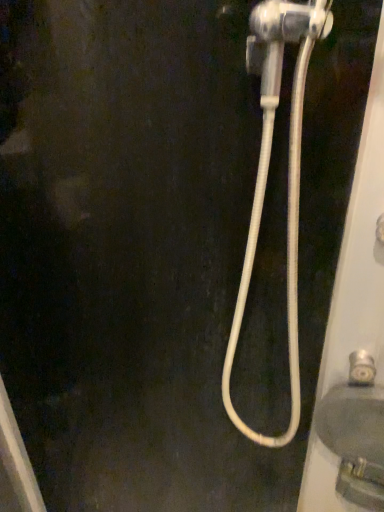
Question: Is silver metallic faucet at lower right far away from matte gray sink at lower right?

Choices:
 (A) yes
 (B) no

Answer: (B)

Question: Is silver metallic faucet at lower right not within matte gray sink at lower right?

Choices:
 (A) yes
 (B) no

Answer: (A)

Question: Does silver metallic faucet at lower right have a lesser width compared to matte gray sink at lower right?

Choices:
 (A) no
 (B) yes

Answer: (B)

Question: Would you say matte gray sink at lower right is part of silver metallic faucet at lower right's contents?

Choices:
 (A) no
 (B) yes

Answer: (A)

Question: Considering the relative positions of silver metallic faucet at lower right and matte gray sink at lower right in the image provided, is silver metallic faucet at lower right to the left of matte gray sink at lower right from the viewer's perspective?

Choices:
 (A) no
 (B) yes

Answer: (B)

Question: From the image's perspective, would you say silver metallic faucet at lower right is shown under matte gray sink at lower right?

Choices:
 (A) yes
 (B) no

Answer: (B)

Question: Can we say matte gray sink at lower right lies outside white rubber hose at right?

Choices:
 (A) no
 (B) yes

Answer: (B)

Question: Is matte gray sink at lower right touching white rubber hose at right?

Choices:
 (A) no
 (B) yes

Answer: (A)

Question: Considering the relative positions of matte gray sink at lower right and white rubber hose at right in the image provided, is matte gray sink at lower right behind white rubber hose at right?

Choices:
 (A) yes
 (B) no

Answer: (A)

Question: Is white rubber hose at right located within matte gray sink at lower right?

Choices:
 (A) no
 (B) yes

Answer: (A)

Question: Are matte gray sink at lower right and white rubber hose at right far apart?

Choices:
 (A) no
 (B) yes

Answer: (A)

Question: Is matte gray sink at lower right shorter than white rubber hose at right?

Choices:
 (A) yes
 (B) no

Answer: (A)

Question: Is matte gray sink at lower right next to silver metallic faucet at lower right?

Choices:
 (A) no
 (B) yes

Answer: (A)